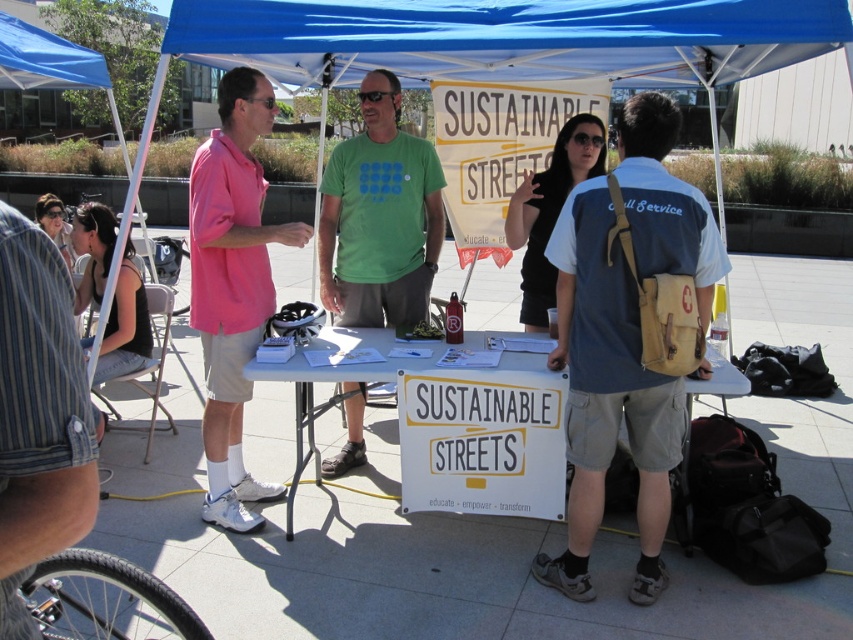
You are a participant at the event and want to pick up the green fabric shirt at center and the black fabric tank top at left. Which one do you need to reach further to grab?

You need to reach further to grab the black fabric tank top at left because the green fabric shirt at center is closer to you than the black fabric tank top at left.

You are a participant at the Sustainable Streets event and need to retrieve your belongings. You see a tan canvas backpack at center and a black fabric tank top at left. Which item is physically nearer to you as you stand in front of the table?

The tan canvas backpack at center is closer to you than the black fabric tank top at left.

You are organizing a clothing donation drive and need to sort items by size. You have a pink cotton shirt at left and a black fabric tank top at left. Which one should you place in the small size bin?

The pink cotton shirt at left is smaller than the black fabric tank top at left, so it should be placed in the small size bin.